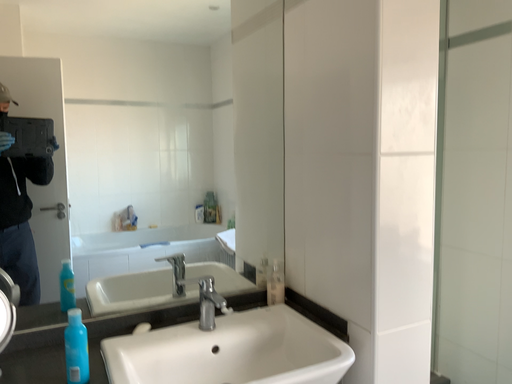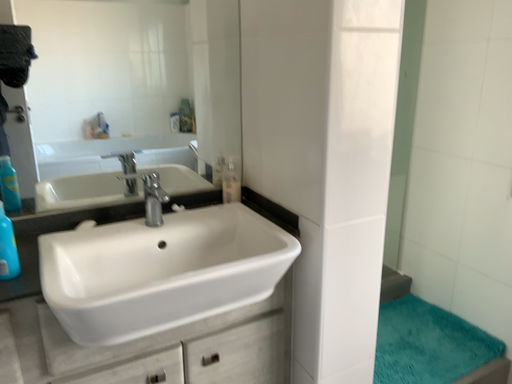
Question: Which way did the camera rotate in the video?

Choices:
 (A) rotated downward
 (B) rotated upward

Answer: (A)